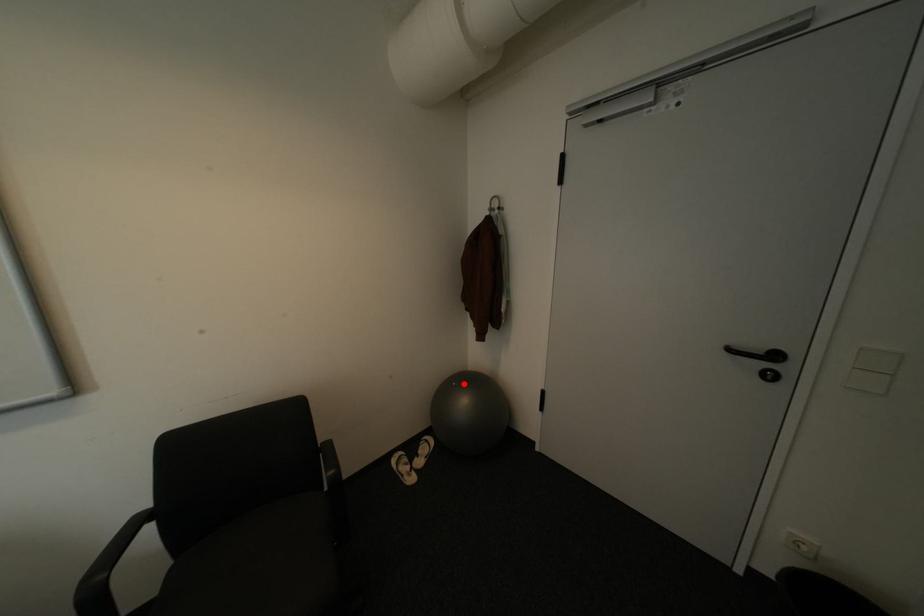
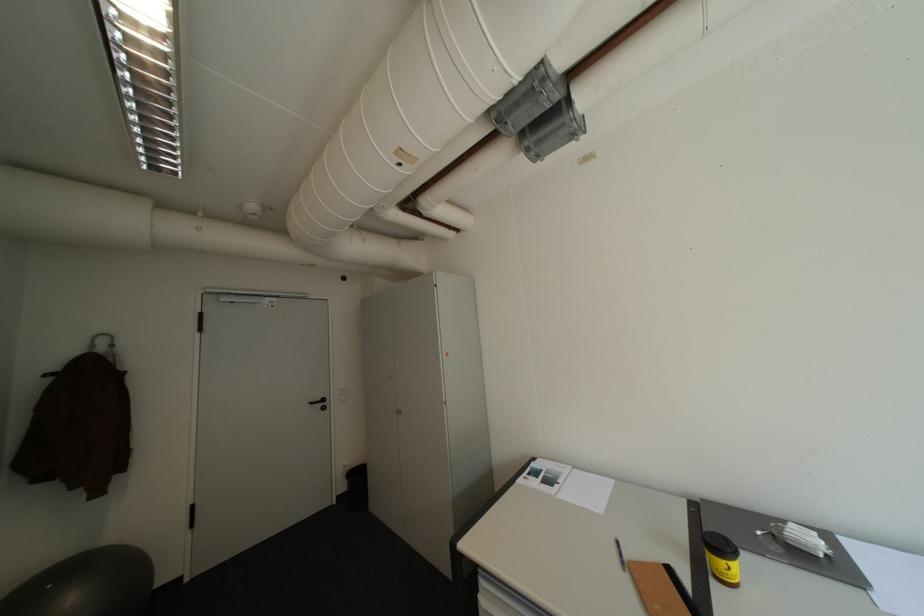
Locate, in the second image, the point that corresponds to the highlighted location in the first image.

(59, 586)